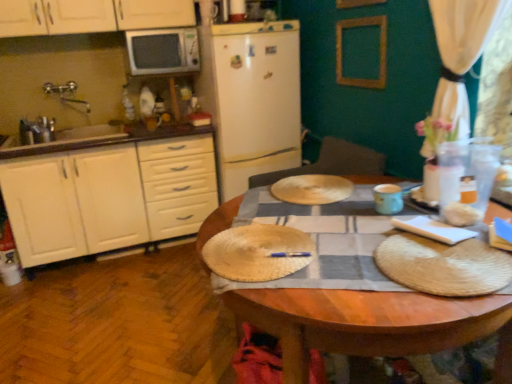
At what (x,y) coordinates should I click in order to perform the action: click on vacant space in between matte blue cup at center right and bamboo placemat at center. Please return your answer as a coordinate pair (x, y). Looking at the image, I should click on (343, 223).